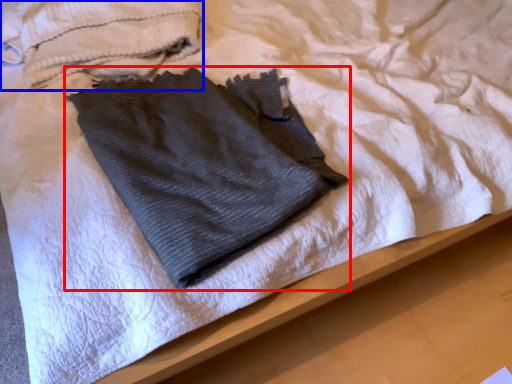
Question: Which object appears closest to the camera in this image, towel (highlighted by a red box) or towel (highlighted by a blue box)?

Choices:
 (A) towel
 (B) towel

Answer: (A)